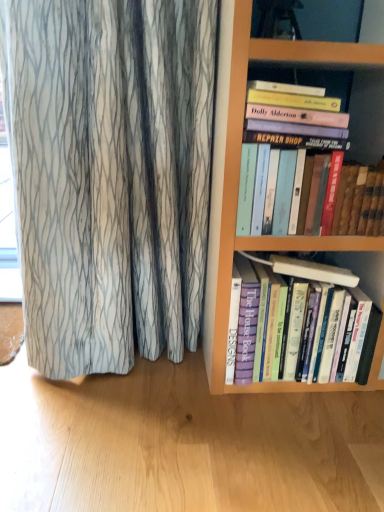
Where is `free space in front of purple hardcover book at center, the first book positioned from the bottom`? free space in front of purple hardcover book at center, the first book positioned from the bottom is located at coordinates (290, 435).